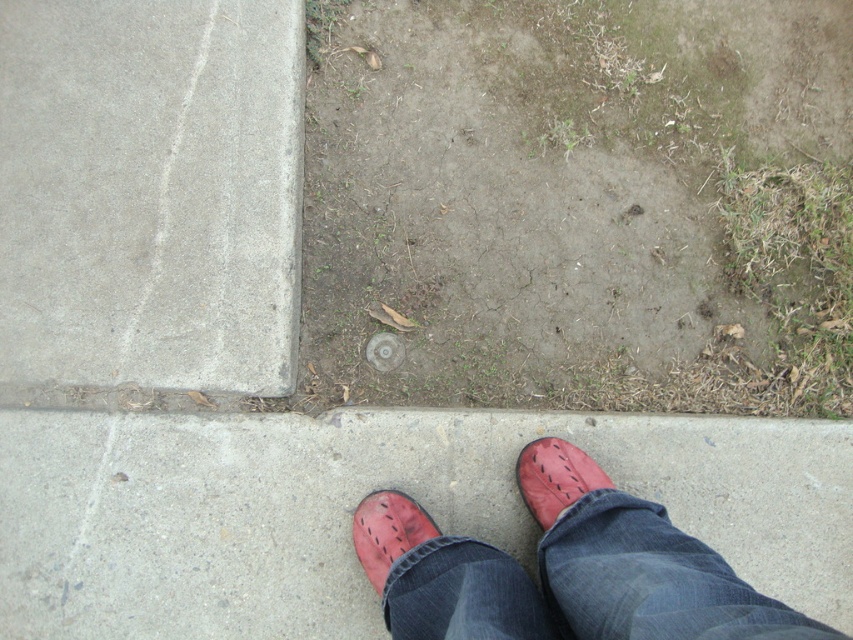
You are a delivery robot navigating a sidewalk. You see the gray concrete at upper left and the leather shoe at lower right. Which object is positioned higher in the image?

The gray concrete at upper left is located above the leather shoe at lower right, so it is positioned higher in the image.

You are a pedestrian standing on the sidewalk. You see your leather shoe at lower right and matte leather shoe at lower center. Which shoe is closer to the patch of bare soil and sparse grass on the right side of the image?

The leather shoe at lower right is closer to the patch of bare soil and sparse grass on the right side of the image because it is positioned to the right of the matte leather shoe at lower center, which is closer to the center of the sidewalk.

You are a fashion designer observing the scene. You need to determine which shoe has a higher height between the leather shoe at lower right and the matte leather shoe at lower center. Based on the scene, which one is taller?

The leather shoe at lower right is much taller than the matte leather shoe at lower center, so the leather shoe at lower right is taller.